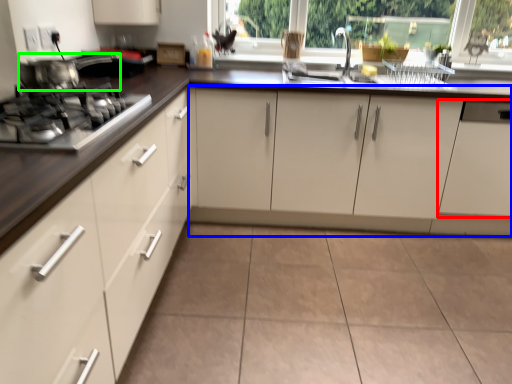
Question: Based on their relative distances, which object is farther from cabinetry (highlighted by a red box)? Choose from cabinetry (highlighted by a blue box) and home appliance (highlighted by a green box).

Choices:
 (A) cabinetry
 (B) home appliance

Answer: (B)